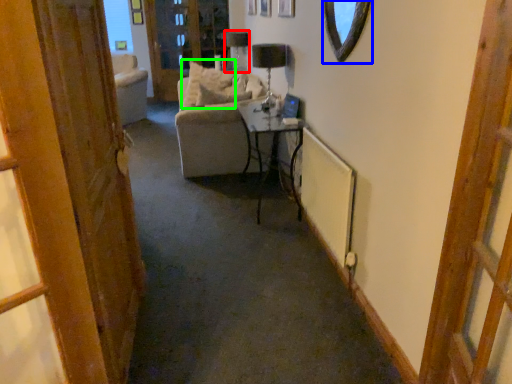
Question: Considering the real-world distances, which object is closest to lamp (highlighted by a red box)? mirror (highlighted by a blue box) or pillow (highlighted by a green box).

Choices:
 (A) mirror
 (B) pillow

Answer: (B)